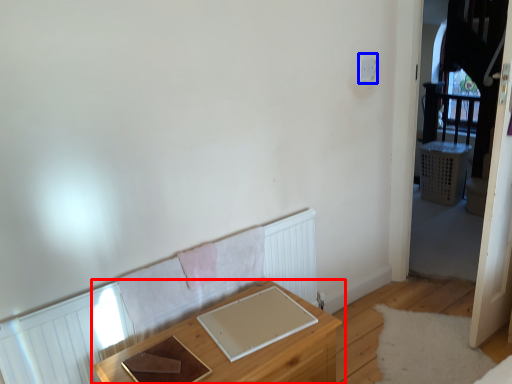
Question: Among these objects, which one is farthest to the camera, table (highlighted by a red box) or light switch (highlighted by a blue box)?

Choices:
 (A) table
 (B) light switch

Answer: (B)